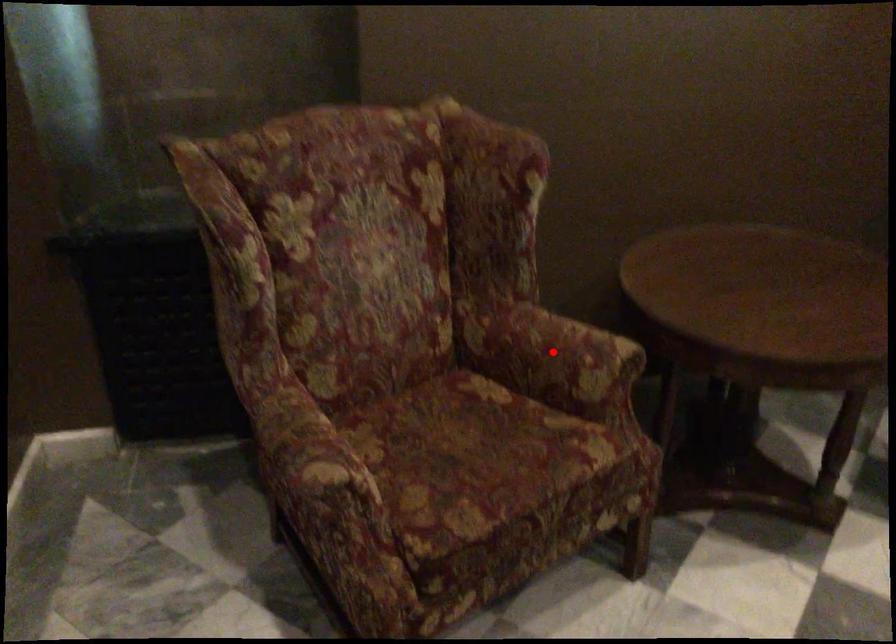
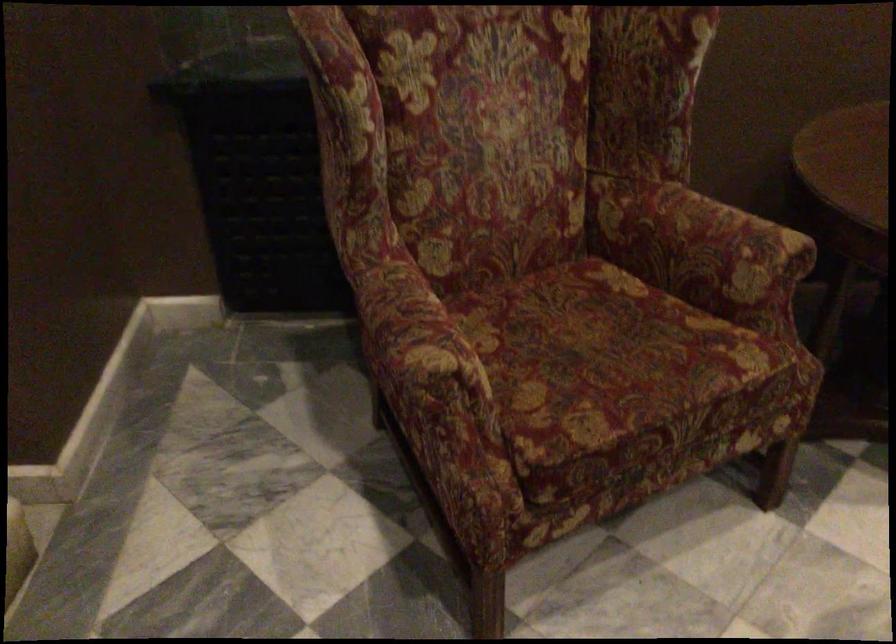
Question: A red point is marked in image1. In image2, is the corresponding 3D point closer to the camera or farther? Reply with the corresponding letter.

Choices:
 (A) The corresponding 3D point is closer.
 (B) The corresponding 3D point is farther.

Answer: (A)